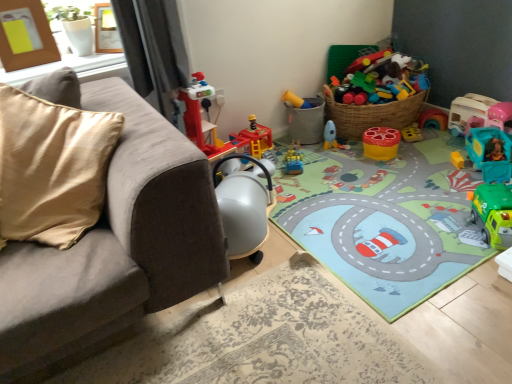
Where is `free space to the left of teal plastic toy car at right, placed as the second toy when sorted from right to left`? The width and height of the screenshot is (512, 384). free space to the left of teal plastic toy car at right, placed as the second toy when sorted from right to left is located at coordinates (435, 170).